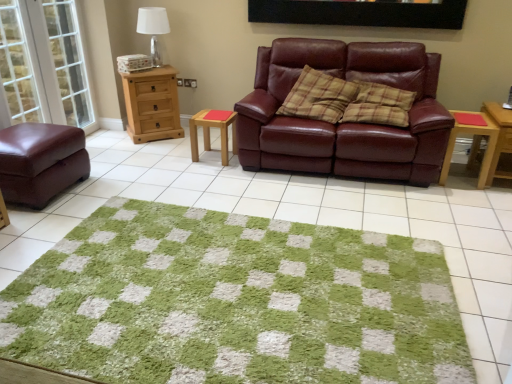
Locate an element on the screen. This screenshot has height=384, width=512. free space in front of shiny brown leather couch at center is located at coordinates (366, 210).